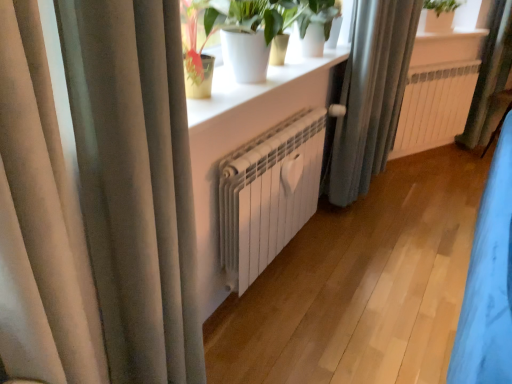
Question: Is white matte radiator at center, which is counted as the 2th radiator, starting from the bottom, closer to camera compared to green fabric curtain at right, the 3th curtain in the front-to-back sequence?

Choices:
 (A) no
 (B) yes

Answer: (B)

Question: Is white matte radiator at center, which appears as the first radiator when viewed from the right, smaller than green fabric curtain at right, placed as the 1th curtain when sorted from back to front?

Choices:
 (A) no
 (B) yes

Answer: (B)

Question: Is the position of white matte radiator at center, positioned as the 1th radiator in top-to-bottom order, more distant than that of green fabric curtain at right, placed as the 1th curtain when sorted from back to front?

Choices:
 (A) no
 (B) yes

Answer: (A)

Question: Is white matte radiator at center, positioned as the 1th radiator in top-to-bottom order, not near green fabric curtain at right, the third curtain viewed from the left?

Choices:
 (A) yes
 (B) no

Answer: (B)

Question: Is white matte radiator at center, the 2th radiator from the left, oriented towards green fabric curtain at right, placed as the 1th curtain when sorted from back to front?

Choices:
 (A) yes
 (B) no

Answer: (B)

Question: From a real-world perspective, is white matte radiator at center, which appears as the first radiator when viewed from the right, on top of green fabric curtain at right, the 3th curtain in the front-to-back sequence?

Choices:
 (A) no
 (B) yes

Answer: (A)

Question: From a real-world perspective, is white matte radiator at center, the 2th radiator from the left, on top of white matte pot at upper center?

Choices:
 (A) yes
 (B) no

Answer: (B)

Question: Considering the relative positions of white matte radiator at center, marked as the 2th radiator in a front-to-back arrangement, and white matte pot at upper center in the image provided, is white matte radiator at center, marked as the 2th radiator in a front-to-back arrangement, to the right of white matte pot at upper center from the viewer's perspective?

Choices:
 (A) no
 (B) yes

Answer: (B)

Question: Is white matte radiator at center, which appears as the first radiator when viewed from the right, smaller than white matte pot at upper center?

Choices:
 (A) no
 (B) yes

Answer: (B)

Question: Is white matte radiator at center, the 2th radiator from the left, thinner than white matte pot at upper center?

Choices:
 (A) no
 (B) yes

Answer: (B)

Question: Considering the relative positions of white matte radiator at center, the 2th radiator from the left, and white matte pot at upper center in the image provided, is white matte radiator at center, the 2th radiator from the left, to the left of white matte pot at upper center from the viewer's perspective?

Choices:
 (A) yes
 (B) no

Answer: (B)

Question: Can you confirm if white matte radiator at center, marked as the 2th radiator in a front-to-back arrangement, is wider than white matte pot at upper center?

Choices:
 (A) no
 (B) yes

Answer: (A)

Question: Can we say satin beige curtain at left, which is the third curtain from right to left, lies outside white matte pot at upper center?

Choices:
 (A) yes
 (B) no

Answer: (A)